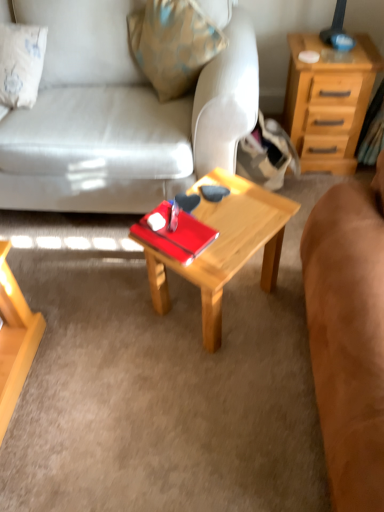
Question: Can you confirm if wooden coffee table at center is taller than matte white couch at center, marked as the 1th studio couch in a left-to-right arrangement?

Choices:
 (A) no
 (B) yes

Answer: (A)

Question: Can you confirm if wooden coffee table at center is thinner than matte white couch at center, the second studio couch in the right-to-left sequence?

Choices:
 (A) no
 (B) yes

Answer: (B)

Question: Can you confirm if wooden coffee table at center is smaller than matte white couch at center, marked as the 1th studio couch in a left-to-right arrangement?

Choices:
 (A) yes
 (B) no

Answer: (A)

Question: Considering the relative sizes of wooden coffee table at center and matte white couch at center, the second studio couch in the right-to-left sequence, in the image provided, is wooden coffee table at center bigger than matte white couch at center, the second studio couch in the right-to-left sequence,?

Choices:
 (A) yes
 (B) no

Answer: (B)

Question: Is wooden coffee table at center not near matte white couch at center, the second studio couch in the right-to-left sequence?

Choices:
 (A) yes
 (B) no

Answer: (B)

Question: Considering the positions of wooden coffee table at center and matte white couch at center, the second studio couch in the right-to-left sequence, in the image, is wooden coffee table at center wider or thinner than matte white couch at center, the second studio couch in the right-to-left sequence,?

Choices:
 (A) thin
 (B) wide

Answer: (A)

Question: Which is correct: wooden coffee table at center is inside matte white couch at center, marked as the 1th studio couch in a left-to-right arrangement, or outside of it?

Choices:
 (A) inside
 (B) outside

Answer: (B)

Question: Is point (279, 249) positioned closer to the camera than point (173, 160)?

Choices:
 (A) farther
 (B) closer

Answer: (A)

Question: Is wooden coffee table at center to the left or to the right of matte white couch at center, the second studio couch in the right-to-left sequence, in the image?

Choices:
 (A) left
 (B) right

Answer: (B)

Question: From the image's perspective, relative to wooden coffee table at center, is matte white couch at center, marked as the 1th studio couch in a left-to-right arrangement, above or below?

Choices:
 (A) above
 (B) below

Answer: (A)

Question: Is matte white couch at center, marked as the 1th studio couch in a left-to-right arrangement, inside the boundaries of wooden coffee table at center, or outside?

Choices:
 (A) outside
 (B) inside

Answer: (A)

Question: Does point (185, 183) appear closer or farther from the camera than point (231, 208)?

Choices:
 (A) closer
 (B) farther

Answer: (B)

Question: In the image, is matte white couch at center, the second studio couch in the right-to-left sequence, positioned in front of or behind wooden coffee table at center?

Choices:
 (A) behind
 (B) front

Answer: (B)

Question: In terms of width, does brown suede couch at center, which is the 2th studio couch in left-to-right order, look wider or thinner when compared to matte white couch at center, the second studio couch in the right-to-left sequence?

Choices:
 (A) wide
 (B) thin

Answer: (B)

Question: From a real-world perspective, is brown suede couch at center, which is the 2th studio couch in left-to-right order, positioned above or below matte white couch at center, marked as the 1th studio couch in a left-to-right arrangement?

Choices:
 (A) below
 (B) above

Answer: (B)